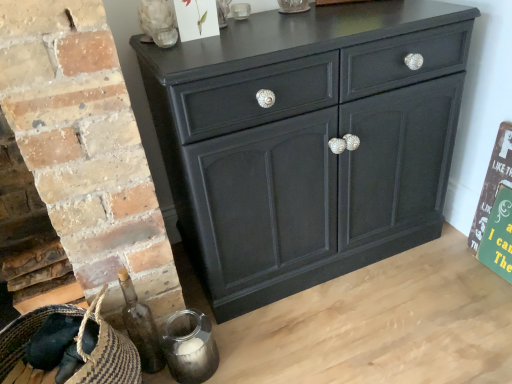
Question: Can rustic wood sign at right be found inside matte black cabinet at center?

Choices:
 (A) yes
 (B) no

Answer: (B)

Question: Are matte black cabinet at center and rustic wood sign at right making contact?

Choices:
 (A) yes
 (B) no

Answer: (B)

Question: Is matte black cabinet at center oriented towards rustic wood sign at right?

Choices:
 (A) no
 (B) yes

Answer: (A)

Question: Is the depth of matte black cabinet at center less than that of rustic wood sign at right?

Choices:
 (A) yes
 (B) no

Answer: (A)

Question: Considering the relative sizes of matte black cabinet at center and rustic wood sign at right in the image provided, is matte black cabinet at center smaller than rustic wood sign at right?

Choices:
 (A) no
 (B) yes

Answer: (A)

Question: Is matte black cabinet at center far away from rustic wood sign at right?

Choices:
 (A) yes
 (B) no

Answer: (B)

Question: Does matte black cabinet at center have a greater width compared to transparent glass skull at upper left?

Choices:
 (A) no
 (B) yes

Answer: (B)

Question: Is matte black cabinet at center to the right of transparent glass skull at upper left from the viewer's perspective?

Choices:
 (A) no
 (B) yes

Answer: (B)

Question: Is matte black cabinet at center at the left side of transparent glass skull at upper left?

Choices:
 (A) yes
 (B) no

Answer: (B)

Question: From a real-world perspective, is matte black cabinet at center physically above transparent glass skull at upper left?

Choices:
 (A) yes
 (B) no

Answer: (B)

Question: From a real-world perspective, is matte black cabinet at center physically below transparent glass skull at upper left?

Choices:
 (A) yes
 (B) no

Answer: (A)

Question: From the image's perspective, would you say matte black cabinet at center is shown under transparent glass skull at upper left?

Choices:
 (A) no
 (B) yes

Answer: (B)

Question: Is matte black cabinet at center bigger than braided straw basket at lower left?

Choices:
 (A) no
 (B) yes

Answer: (B)